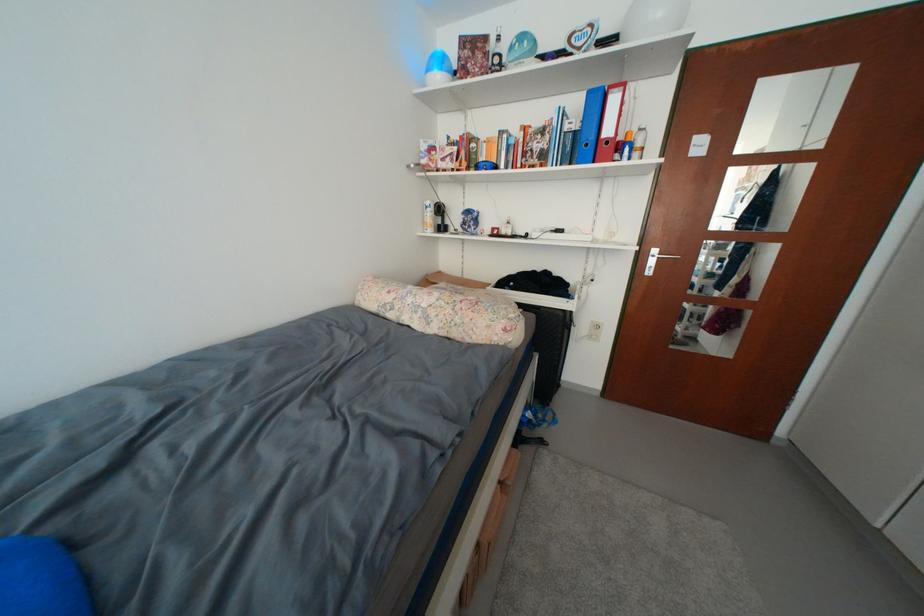
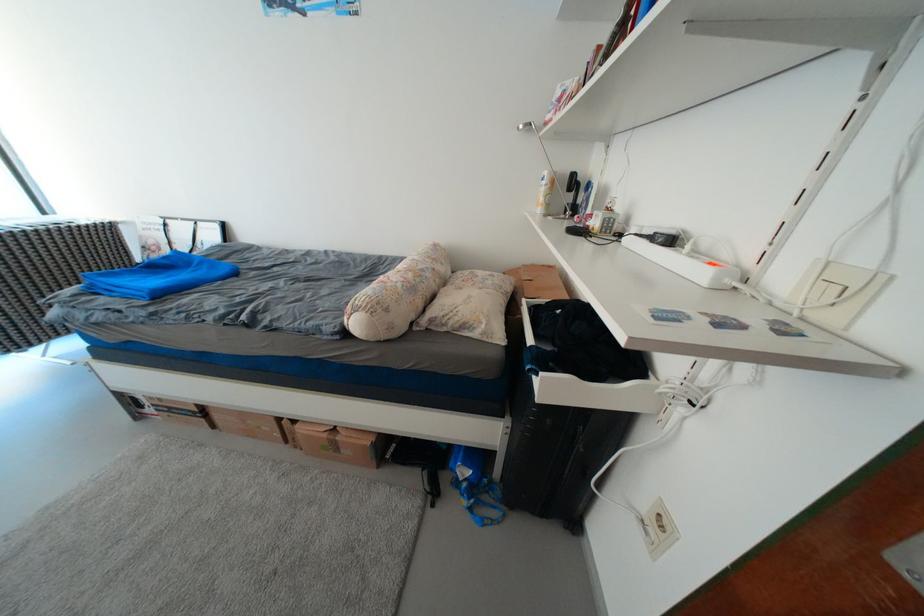
Find the pixel in the second image that matches point 438,212 in the first image.

(553, 185)